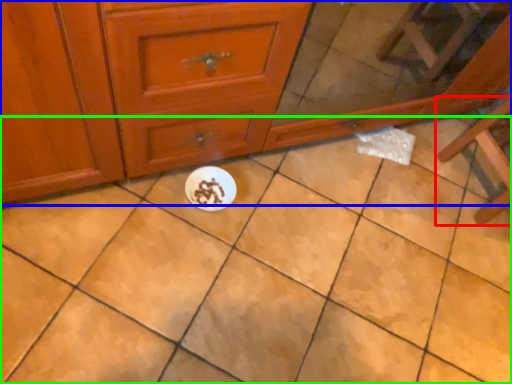
Question: Based on their relative distances, which object is nearer to furniture (highlighted by a red box)? Choose from chest of drawers (highlighted by a blue box) and ceramic tile (highlighted by a green box).

Choices:
 (A) chest of drawers
 (B) ceramic tile

Answer: (B)